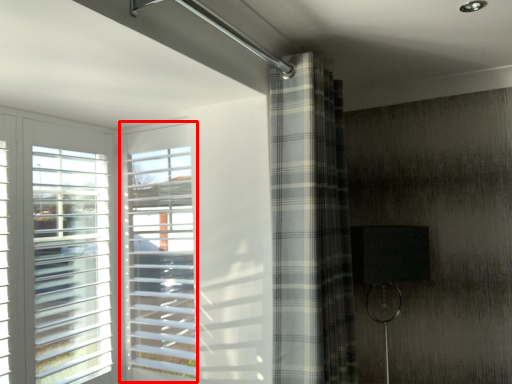
Question: From the image, what is the correct spatial relationship of window (annotated by the red box) in relation to curtain?

Choices:
 (A) left
 (B) right

Answer: (A)